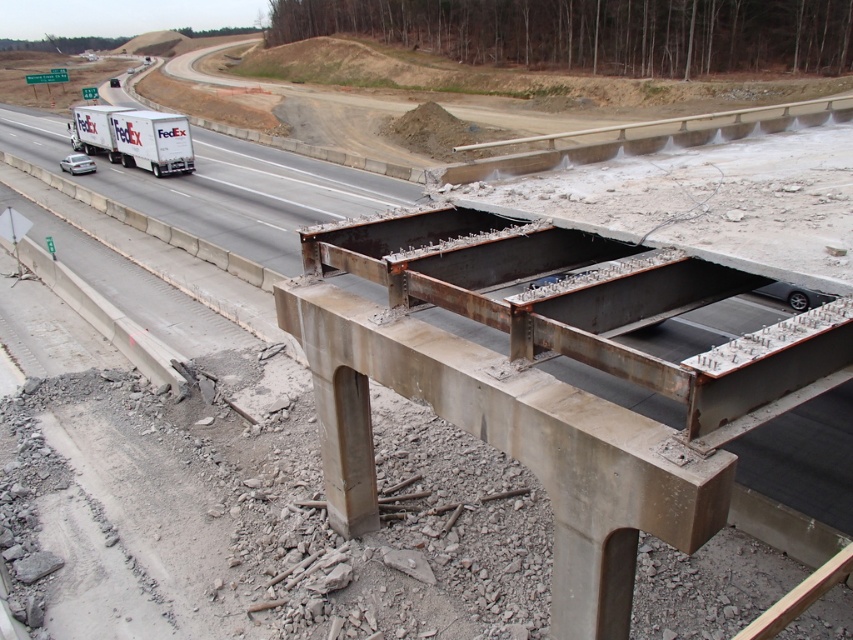
Who is higher up, rusty metal bridge at center or matte white trailer truck at left?

matte white trailer truck at left is higher up.

Between rusty metal bridge at center and matte white trailer truck at left, which one is positioned lower?

rusty metal bridge at center is below.

Which is in front, point (451, 406) or point (132, 132)?

Positioned in front is point (451, 406).

The height and width of the screenshot is (640, 853). I want to click on rusty metal bridge at center, so click(547, 380).

Which is more to the left, rusty metal bridge at center or white matte truck at left?

white matte truck at left

Does rusty metal bridge at center have a lesser height compared to white matte truck at left?

Correct, rusty metal bridge at center is not as tall as white matte truck at left.

At what (x,y) coordinates should I click in order to perform the action: click on rusty metal bridge at center. Please return your answer as a coordinate pair (x, y). This screenshot has height=640, width=853. Looking at the image, I should click on (547, 380).

You are a GUI agent. You are given a task and a screenshot of the screen. Output one action in this format:
    pyautogui.click(x=<x>, y=<y>)
    Task: Click on the rusty metal bridge at center
    
    Given the screenshot: What is the action you would take?
    pyautogui.click(x=547, y=380)

Is white matte truck at left below matte white trailer truck at left?

Correct, white matte truck at left is located below matte white trailer truck at left.

Is white matte truck at left in front of matte white trailer truck at left?

Yes, it is.

Is point (270, 227) closer to camera compared to point (149, 124)?

Yes, point (270, 227) is closer to viewer.

Identify the location of white matte truck at left. (251, 196).